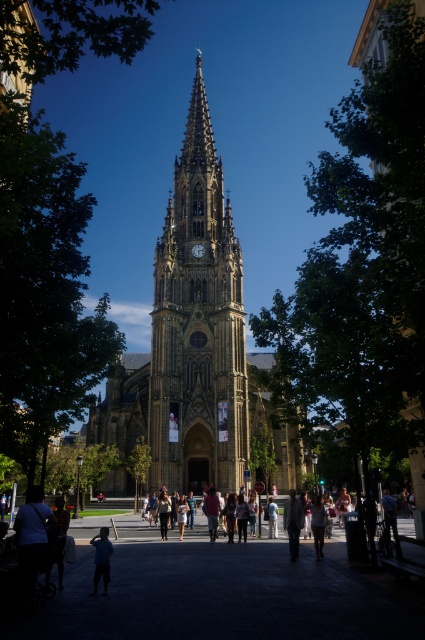
Who is shorter, golden stone tower at center or dark blue shirt at lower left?

dark blue shirt at lower left is shorter.

From the picture: Does golden stone tower at center have a greater width compared to dark blue shirt at lower left?

Yes, golden stone tower at center is wider than dark blue shirt at lower left.

This screenshot has height=640, width=425. I want to click on golden stone tower at center, so click(198, 324).

Find the location of a particular element. Image resolution: width=425 pixels, height=640 pixels. golden stone tower at center is located at coordinates (198, 324).

Is point (34, 552) closer to camera compared to point (286, 529)?

Yes, it is in front of point (286, 529).

From the picture: Is dark blue shirt at lower left wider than light beige fabric jacket at center?

Indeed, dark blue shirt at lower left has a greater width compared to light beige fabric jacket at center.

This screenshot has width=425, height=640. In order to click on dark blue shirt at lower left in this screenshot , I will do `click(31, 538)`.

Which is above, golden stone tower at center or light brown leather jacket at lower center?

Positioned higher is golden stone tower at center.

Consider the image. Who is positioned more to the left, golden stone tower at center or light brown leather jacket at lower center?

Positioned to the left is golden stone tower at center.

Between point (159, 387) and point (322, 524), which one is positioned in front?

Positioned in front is point (322, 524).

Identify the location of golden stone tower at center. The width and height of the screenshot is (425, 640). (198, 324).